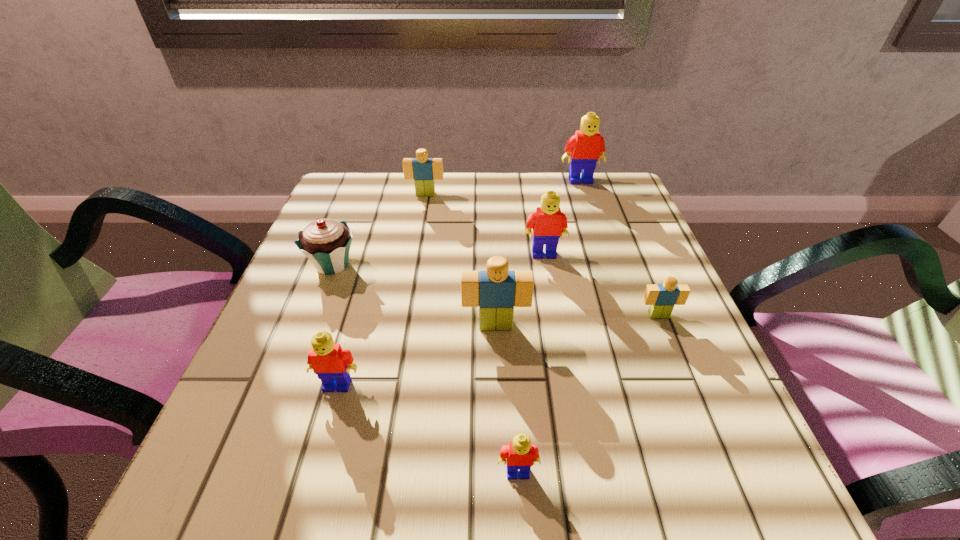
Locate an element on the screen. This screenshot has height=540, width=960. object identified as the second closest to the third smallest yellow Lego is located at coordinates (662, 298).

Locate an element on the screen. the seventh closest object relative to the third nearest yellow Lego is located at coordinates (520, 454).

You are a GUI agent. You are given a task and a screenshot of the screen. Output one action in this format:
    pyautogui.click(x=<x>, y=<y>)
    Task: Click on the closest Lego relative to the cupcake
    
    Given the screenshot: What is the action you would take?
    pyautogui.click(x=423, y=170)

Identify the location of Lego that is the third closest one to the second yellow Lego from right to left. The height and width of the screenshot is (540, 960). (587, 146).

Point out which yellow Lego is positioned as the second nearest to the tallest object. Please provide its 2D coordinates. Your answer should be formatted as a tuple, i.e. [(x, y)], where the tuple contains the x and y coordinates of a point satisfying the conditions above.

[(332, 365)]

Image resolution: width=960 pixels, height=540 pixels. What are the coordinates of `yellow Lego object that ranks as the closest to the cupcake` in the screenshot? It's located at (332, 365).

The width and height of the screenshot is (960, 540). I want to click on beige Lego that is the second closest to the smallest beige Lego, so click(423, 170).

Select which beige Lego appears as the third closest to the second yellow Lego from left to right. Please provide its 2D coordinates. Your answer should be formatted as a tuple, i.e. [(x, y)], where the tuple contains the x and y coordinates of a point satisfying the conditions above.

[(423, 170)]